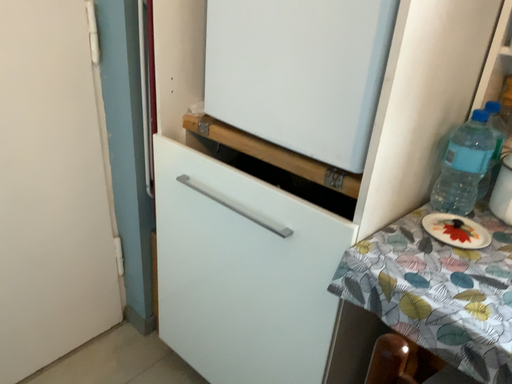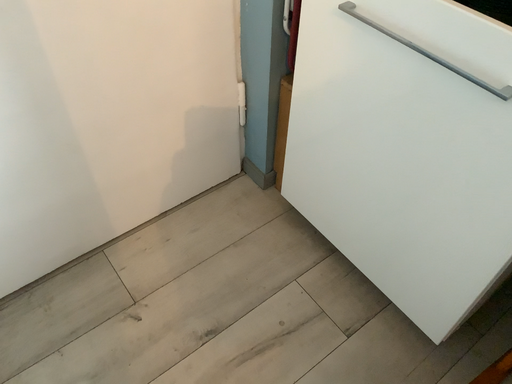
Question: How did the camera likely rotate when shooting the video?

Choices:
 (A) rotated right
 (B) rotated left

Answer: (B)